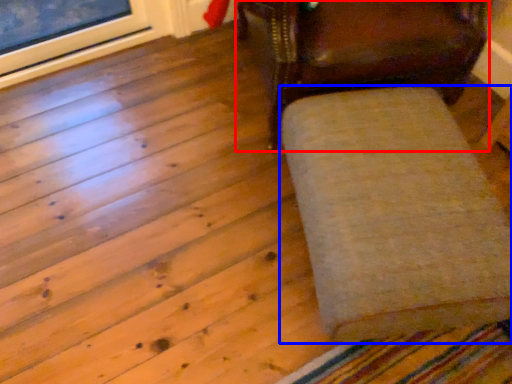
Question: Which of the following is the farthest to the observer, chair (highlighted by a red box) or furniture (highlighted by a blue box)?

Choices:
 (A) chair
 (B) furniture

Answer: (A)